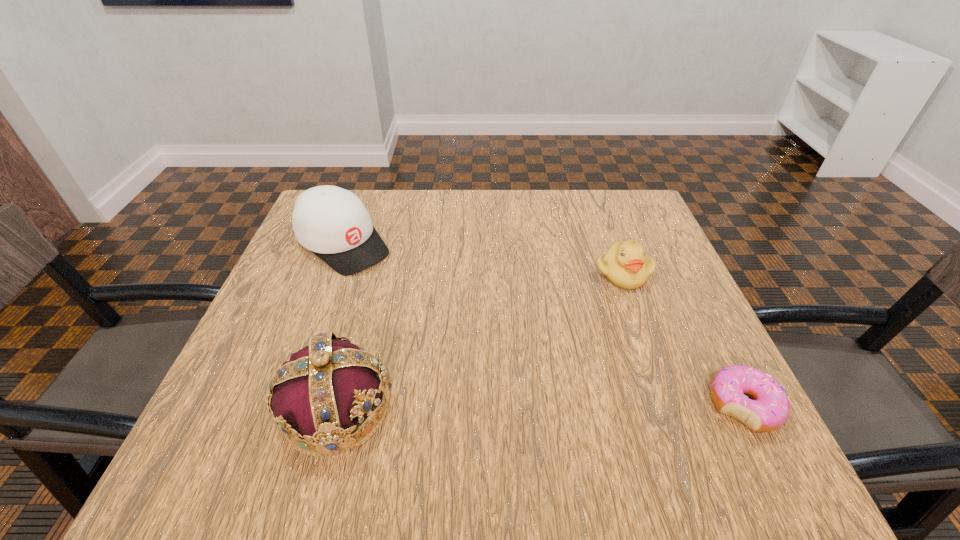
The height and width of the screenshot is (540, 960). I want to click on vacant space on the desktop that is between the crown and the shortest object and is positioned on the front-facing side of the baseball cap, so click(551, 407).

Where is `free space on the desktop that is between the crown and the rightmost object and is positioned on the front-facing side of the duckling`? The width and height of the screenshot is (960, 540). free space on the desktop that is between the crown and the rightmost object and is positioned on the front-facing side of the duckling is located at coordinates (557, 407).